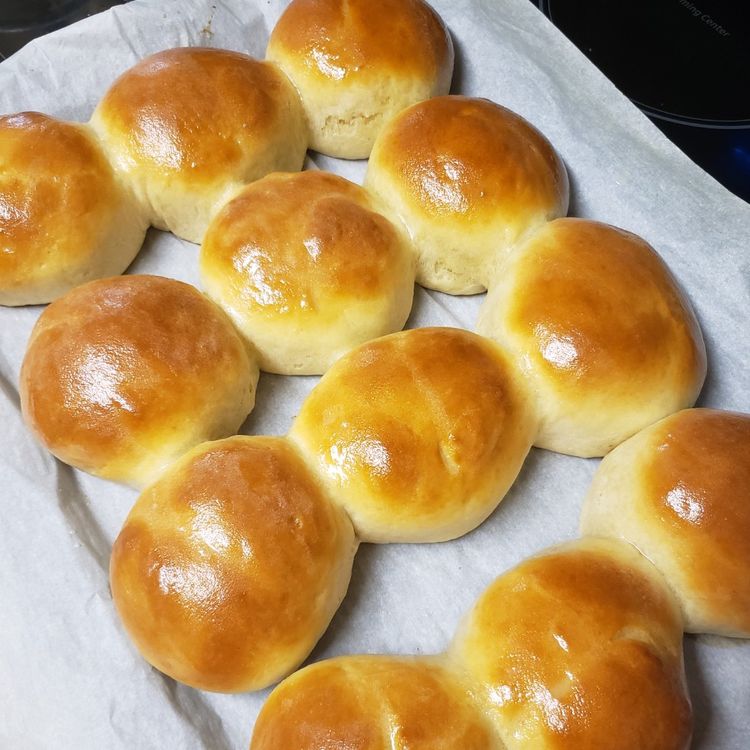
I want to click on baking paper, so click(x=688, y=184), click(x=49, y=67), click(x=424, y=589), click(x=108, y=687).